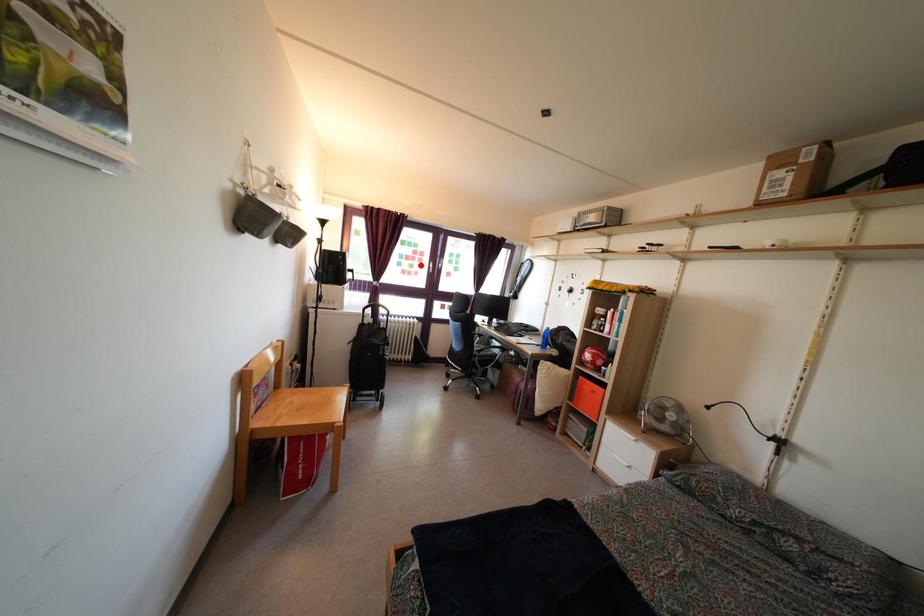
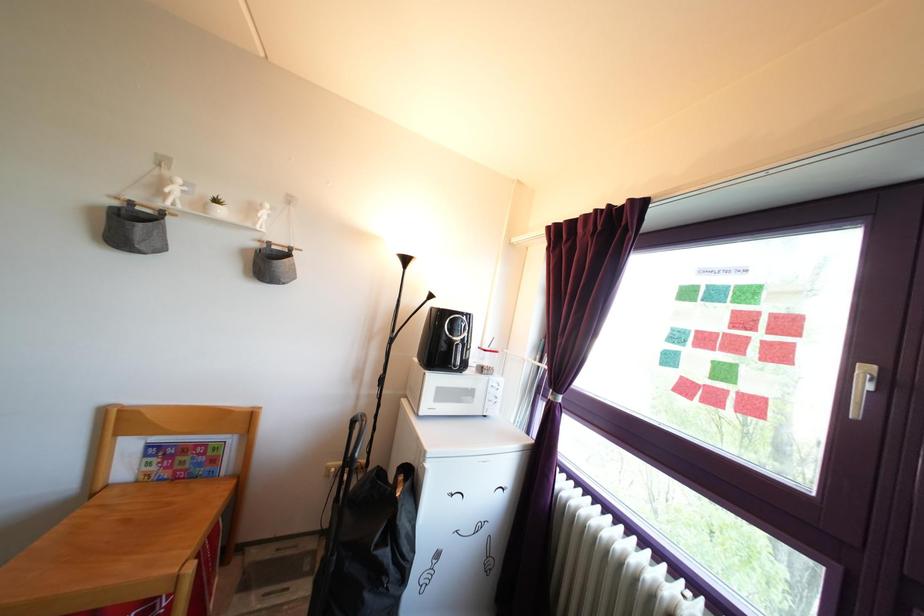
Locate, in the second image, the point that corresponds to the highlighted location in the first image.

(761, 345)